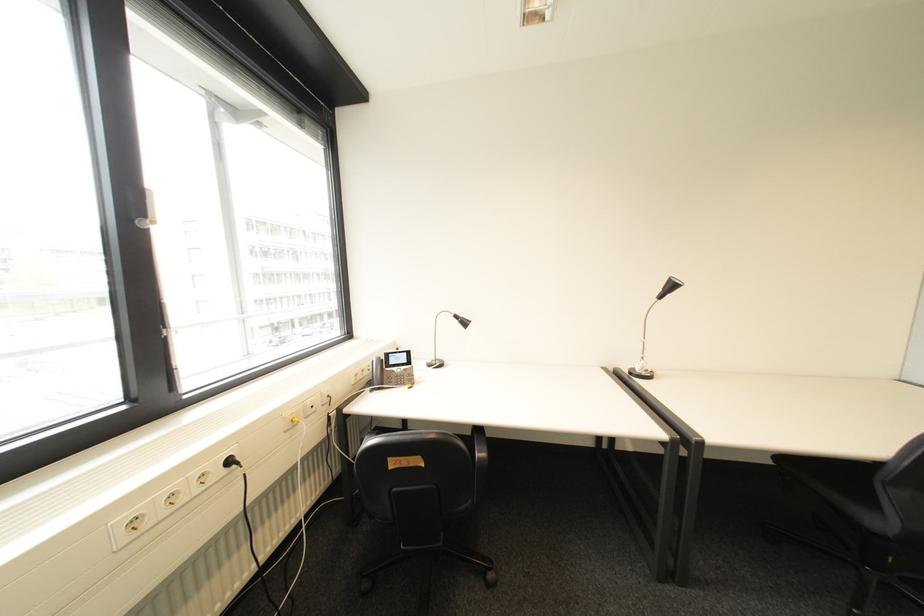
Find where to rest the black chair armrest. Please return your answer as a coordinate pair (x, y).

(480, 438)